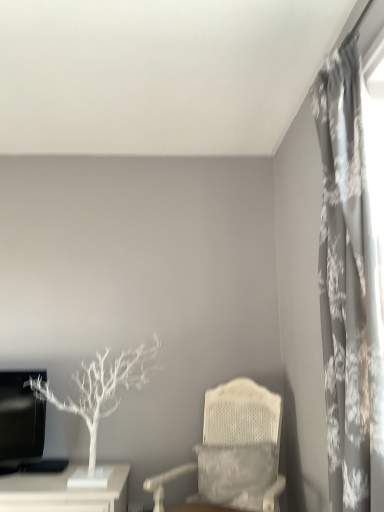
The width and height of the screenshot is (384, 512). Find the location of `white matte tree at left`. white matte tree at left is located at coordinates (100, 396).

Find the location of a particular element. This screenshot has width=384, height=512. white textured chair at center is located at coordinates (235, 449).

The height and width of the screenshot is (512, 384). What are the coordinates of `white matte tree at left` in the screenshot? It's located at (100, 396).

Can you confirm if white matte table at lower left is positioned to the right of white textured chair at center?

No.

Does point (126, 465) come closer to viewer compared to point (205, 454)?

That is False.

Looking at their sizes, would you say white matte table at lower left is wider or thinner than white textured chair at center?

In the image, white matte table at lower left appears to be more narrow than white textured chair at center.

In terms of size, does white matte table at lower left appear bigger or smaller than white textured chair at center?

In the image, white matte table at lower left appears to be smaller than white textured chair at center.

From the image's perspective, between gray floral fabric curtain at right and white textured chair at center, which one is located above?

From the image's view, gray floral fabric curtain at right is above.

Is gray floral fabric curtain at right directly adjacent to white textured chair at center?

gray floral fabric curtain at right is not next to white textured chair at center, and they're not touching.

Is gray floral fabric curtain at right spatially inside white textured chair at center, or outside of it?

gray floral fabric curtain at right is not inside white textured chair at center, it's outside.

Which is more to the right, gray floral fabric curtain at right or white textured chair at center?

From the viewer's perspective, gray floral fabric curtain at right appears more on the right side.

Is gray floral fabric curtain at right taller or shorter than white matte table at lower left?

Considering their sizes, gray floral fabric curtain at right has more height than white matte table at lower left.

Between gray floral fabric curtain at right and white matte table at lower left, which one is positioned in front?

gray floral fabric curtain at right is more forward.

From the image's perspective, does gray floral fabric curtain at right appear lower than white matte table at lower left?

No, from the image's perspective, gray floral fabric curtain at right is not beneath white matte table at lower left.

Who is taller, white textured chair at center or gray floral fabric curtain at right?

With more height is gray floral fabric curtain at right.

Is point (232, 446) behind point (333, 432)?

Yes, point (232, 446) is behind point (333, 432).

From the image's perspective, is white textured chair at center located above or below white matte table at lower left?

Clearly, from the image's perspective, white textured chair at center is above white matte table at lower left.

Is there a large distance between white textured chair at center and white matte table at lower left?

They are positioned close to each other.

Is white textured chair at center wider than white matte table at lower left?

Yes, white textured chair at center is wider than white matte table at lower left.

Is white textured chair at center looking in the opposite direction of white matte table at lower left?

No, white textured chair at center is not facing away from white matte table at lower left.

From a real-world perspective, is white matte table at lower left positioned over gray floral fabric curtain at right based on gravity?

No, from a real-world perspective, white matte table at lower left is not over gray floral fabric curtain at right

Are white matte table at lower left and gray floral fabric curtain at right far apart?

Absolutely, white matte table at lower left is distant from gray floral fabric curtain at right.

From the image's perspective, which one is positioned higher, white matte table at lower left or gray floral fabric curtain at right?

gray floral fabric curtain at right, from the image's perspective.

Does point (61, 506) appear closer or farther from the camera than point (359, 221)?

Point (61, 506) is farther from the camera than point (359, 221).

Is point (122, 379) farther from viewer compared to point (236, 482)?

Yes, point (122, 379) is behind point (236, 482).

At what (x,y) coordinates should I click in order to perform the action: click on houseplant above the white textured chair at center (from a real-world perspective). Please return your answer as a coordinate pair (x, y). The image size is (384, 512). Looking at the image, I should click on (100, 396).

Is the position of white matte tree at left less distant than that of white textured chair at center?

No.

Considering the relative positions of white matte tree at left and white textured chair at center in the image provided, is white matte tree at left to the right of white textured chair at center from the viewer's perspective?

Incorrect, white matte tree at left is not on the right side of white textured chair at center.

At what (x,y) coordinates should I click in order to perform the action: click on chair in front of the white matte table at lower left. Please return your answer as a coordinate pair (x, y). Looking at the image, I should click on pyautogui.click(x=235, y=449).

The height and width of the screenshot is (512, 384). I want to click on curtain on the right of white textured chair at center, so click(x=350, y=287).

Estimate the real-world distances between objects in this image. Which object is further from gray floral fabric curtain at right, white textured chair at center or white matte table at lower left?

white matte table at lower left lies further to gray floral fabric curtain at right than the other object.

Looking at the image, which one is located further to white matte tree at left, white matte table at lower left or white textured chair at center?

white textured chair at center is further to white matte tree at left.

Based on their spatial positions, is white textured chair at center or white matte tree at left closer to gray floral fabric curtain at right?

white textured chair at center.

From the image, which object appears to be farther from white matte table at lower left, white textured chair at center or white matte tree at left?

Based on the image, white textured chair at center appears to be further to white matte table at lower left.

From the image, which object appears to be farther from white matte tree at left, white textured chair at center or white matte table at lower left?

Based on the image, white textured chair at center appears to be further to white matte tree at left.

Consider the image. Estimate the real-world distances between objects in this image. Which object is closer to white matte tree at left, gray floral fabric curtain at right or white matte table at lower left?

Based on the image, white matte table at lower left appears to be nearer to white matte tree at left.

Which object lies nearer to the anchor point white matte tree at left, gray floral fabric curtain at right or white textured chair at center?

Among the two, white textured chair at center is located nearer to white matte tree at left.

Based on their spatial positions, is gray floral fabric curtain at right or white textured chair at center further from white matte table at lower left?

gray floral fabric curtain at right is positioned further to the anchor white matte table at lower left.

You are a GUI agent. You are given a task and a screenshot of the screen. Output one action in this format:
    pyautogui.click(x=<x>, y=<y>)
    Task: Click on the chair positioned between gray floral fabric curtain at right and white matte tree at left from near to far
    This screenshot has width=384, height=512.
    Given the screenshot: What is the action you would take?
    pyautogui.click(x=235, y=449)

The height and width of the screenshot is (512, 384). In order to click on chair between gray floral fabric curtain at right and white matte table at lower left vertically in this screenshot , I will do `click(235, 449)`.

Where is `houseplant between white matte table at lower left and white textured chair at center`? The width and height of the screenshot is (384, 512). houseplant between white matte table at lower left and white textured chair at center is located at coordinates (100, 396).

Find the location of a particular element. This screenshot has width=384, height=512. houseplant located between white matte table at lower left and gray floral fabric curtain at right in the left-right direction is located at coordinates (100, 396).